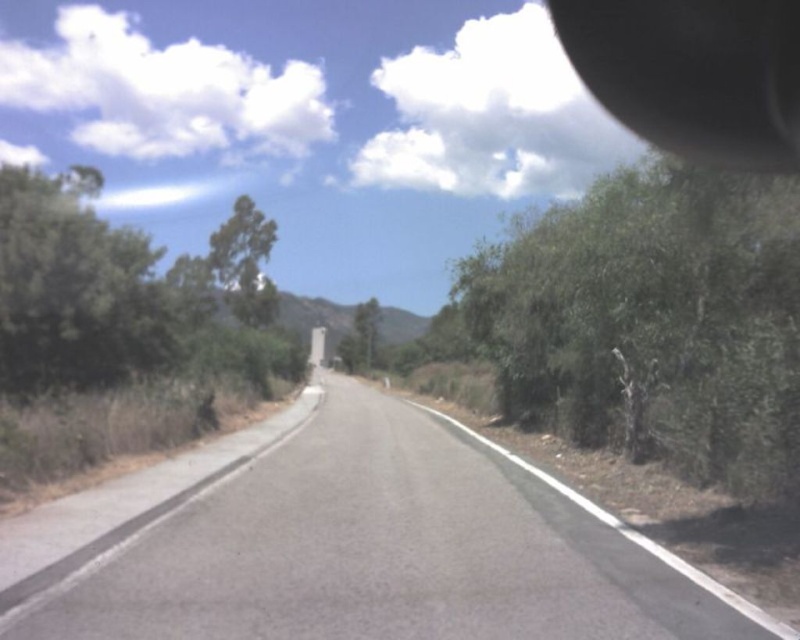
Looking at this image, between green leafy tree at left and green leafy tree at upper left, which one has more height?

green leafy tree at upper left

Does point (158, 321) come in front of point (242, 221)?

That is True.

Which is behind, point (130, 272) or point (234, 289)?

Point (234, 289)

Where is `green leafy tree at left`? green leafy tree at left is located at coordinates coord(86,289).

Consider the image. Between green leafy tree at left and green leafy tree at center, which one has less height?

green leafy tree at center is shorter.

Does green leafy tree at left appear over green leafy tree at center?

Correct, green leafy tree at left is located above green leafy tree at center.

Who is more forward, (173,348) or (354,323)?

Point (173,348)

Identify the location of green leafy tree at left. (86, 289).

Between green leafy tree at right and green leafy tree at upper left, which one is positioned lower?

green leafy tree at right is lower down.

Between green leafy tree at right and green leafy tree at upper left, which one is positioned higher?

green leafy tree at upper left is above.

Between point (516, 385) and point (224, 250), which one is positioned in front?

Point (516, 385)

You are a GUI agent. You are given a task and a screenshot of the screen. Output one action in this format:
    pyautogui.click(x=<x>, y=<y>)
    Task: Click on the green leafy tree at right
    The width and height of the screenshot is (800, 640).
    Given the screenshot: What is the action you would take?
    pyautogui.click(x=648, y=323)